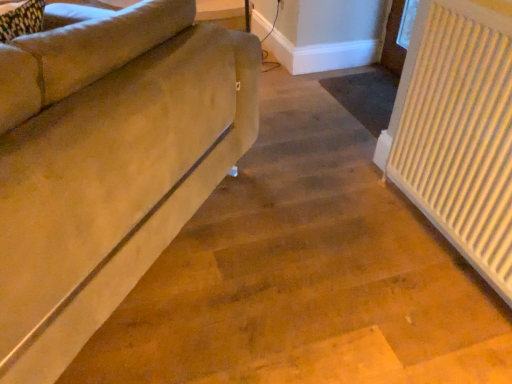
This screenshot has height=384, width=512. Describe the element at coordinates (108, 164) in the screenshot. I see `suede-like beige couch at left` at that location.

Locate an element on the screen. The width and height of the screenshot is (512, 384). suede-like beige couch at left is located at coordinates (108, 164).

Describe the element at coordinates (458, 130) in the screenshot. The width and height of the screenshot is (512, 384). I see `white textured radiator at right` at that location.

At what (x,y) coordinates should I click in order to perform the action: click on white textured radiator at right. Please return your answer as a coordinate pair (x, y). The height and width of the screenshot is (384, 512). Looking at the image, I should click on (458, 130).

You are a GUI agent. You are given a task and a screenshot of the screen. Output one action in this format:
    pyautogui.click(x=<x>, y=<y>)
    Task: Click on the suede-like beige couch at left
    
    Given the screenshot: What is the action you would take?
    pyautogui.click(x=108, y=164)

Is white textured radiator at right to the right of suede-like beige couch at left from the viewer's perspective?

Yes.

Which is in front, white textured radiator at right or suede-like beige couch at left?

suede-like beige couch at left is in front.

Between point (419, 95) and point (150, 29), which one is positioned behind?

Positioned behind is point (419, 95).

From the image's perspective, is white textured radiator at right located above suede-like beige couch at left?

No.

From a real-world perspective, is white textured radiator at right under suede-like beige couch at left?

Yes, from a real-world perspective, white textured radiator at right is under suede-like beige couch at left.

Can you confirm if white textured radiator at right is thinner than suede-like beige couch at left?

Yes.

Is white textured radiator at right shorter than suede-like beige couch at left?

Incorrect, the height of white textured radiator at right does not fall short of that of suede-like beige couch at left.

Is white textured radiator at right bigger or smaller than suede-like beige couch at left?

Considering their sizes, white textured radiator at right takes up less space than suede-like beige couch at left.

Is white textured radiator at right inside or outside of suede-like beige couch at left?

The correct answer is: outside.

Is white textured radiator at right in contact with suede-like beige couch at left?

There is a gap between white textured radiator at right and suede-like beige couch at left.

Is white textured radiator at right positioned with its back to suede-like beige couch at left?

No, white textured radiator at right's orientation is not away from suede-like beige couch at left.

Can you tell me how much white textured radiator at right and suede-like beige couch at left differ in facing direction?

There is a 42.3-degree angle between the facing directions of white textured radiator at right and suede-like beige couch at left.

I want to click on radiator behind the suede-like beige couch at left, so click(x=458, y=130).

Between suede-like beige couch at left and white textured radiator at right, which one appears on the left side from the viewer's perspective?

Positioned to the left is suede-like beige couch at left.

Is suede-like beige couch at left in front of or behind white textured radiator at right in the image?

In the image, suede-like beige couch at left appears in front of white textured radiator at right.

Which is behind, point (207, 113) or point (479, 44)?

The point (207, 113) is farther.

From the image's perspective, is suede-like beige couch at left on white textured radiator at right?

Correct, suede-like beige couch at left appears higher than white textured radiator at right in the image.

From a real-world perspective, is suede-like beige couch at left physically located above or below white textured radiator at right?

suede-like beige couch at left is above white textured radiator at right.

Consider the image. Which of these two, suede-like beige couch at left or white textured radiator at right, is thinner?

Thinner between the two is white textured radiator at right.

Consider the image. Is suede-like beige couch at left taller than white textured radiator at right?

In fact, suede-like beige couch at left may be shorter than white textured radiator at right.

Consider the image. Which of these two, suede-like beige couch at left or white textured radiator at right, is smaller?

white textured radiator at right is smaller.

Is white textured radiator at right surrounded by suede-like beige couch at left?

No, white textured radiator at right is not surrounded by suede-like beige couch at left.

Is suede-like beige couch at left placed right next to white textured radiator at right?

No, suede-like beige couch at left is not next to white textured radiator at right.

Is suede-like beige couch at left aimed at white textured radiator at right?

No.

Where is `studio couch above the white textured radiator at right (from a real-world perspective)`? studio couch above the white textured radiator at right (from a real-world perspective) is located at coordinates (108, 164).

Find the location of a particular element. Image resolution: width=512 pixels, height=384 pixels. studio couch above the white textured radiator at right (from a real-world perspective) is located at coordinates (108, 164).

Locate an element on the screen. The image size is (512, 384). radiator below the suede-like beige couch at left (from a real-world perspective) is located at coordinates (458, 130).